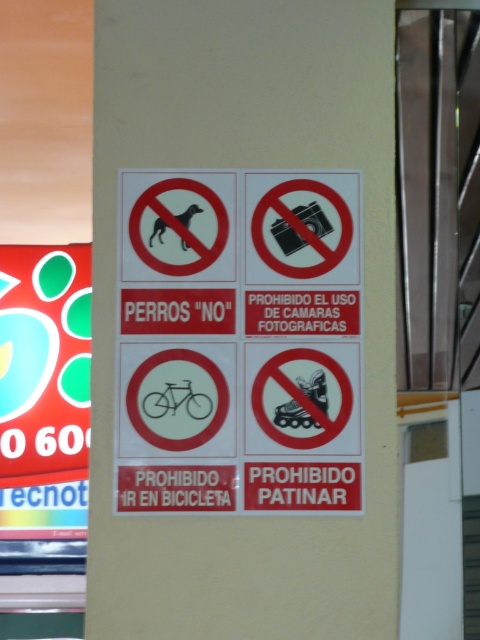
You are standing at the black paper sign at center. You want to take a photo of the camera sign. Can you reach the camera sign without moving from your current position?

The black paper sign at center and camera are 3.00 meters apart, so you can reach the camera sign without moving from your current position since 3.00 meters is within a comfortable reaching distance.

You are standing in front of the wall with the black paper sign at center and the red glossy poster at left. Which object is shorter?

The black paper sign at center is shorter than the red glossy poster at left.

You are standing in front of a wall with a black paper sign at center and a red glossy poster at left. Which object is nearer to you?

The black paper sign at center is closer to the viewer than the red glossy poster at left.